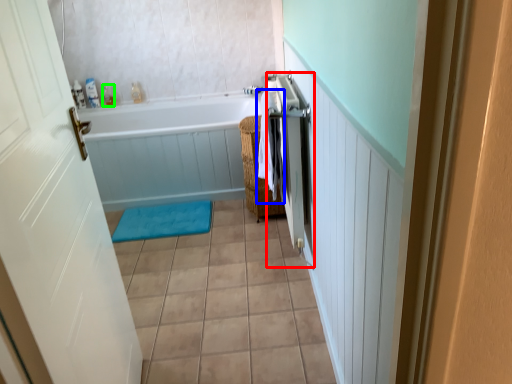
Question: Considering the real-world distances, which object is closest to shower door (highlighted by a red box)? beach towel (highlighted by a blue box) or toiletry (highlighted by a green box).

Choices:
 (A) beach towel
 (B) toiletry

Answer: (A)